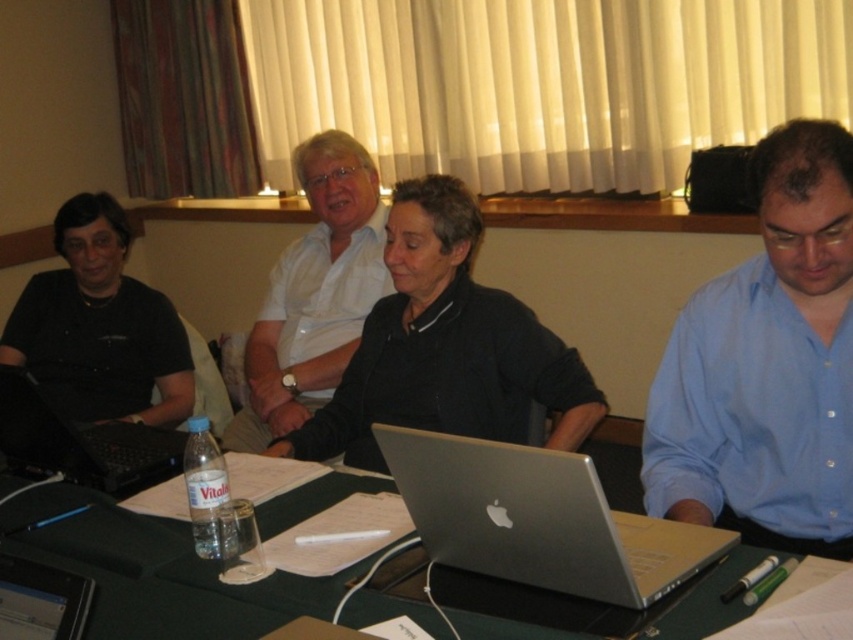
You are a delivery person who needs to place a 25 inch box on the table between the matte black laptop at left and the black matte laptop at left. Can the box fit between them without overlapping either laptop?

The distance between the matte black laptop at left and the black matte laptop at left is 25.15 inches. Since the box is 25 inches long, there is enough space to place it between them without overlapping either laptop.

You are sitting at the table in the conference room and want to place a small object exactly at the point labeled as point (538, 518). Where should you place it?

You should place the small object on the silver metallic laptop at center, as the point (538, 518) is located on it.

You are standing in the conference room and need to place a 12 inch by 12 inch square box on the green matte table at center. Based on the table coordinates provided, is there enough space to place the box without overlapping any existing items?

The green matte table at center is located at coordinates point (155, 572). However, the description does not provide information about the table size or the arrangement of existing items on it. Therefore, it is impossible to determine if there is enough space to place the box without overlapping existing items.